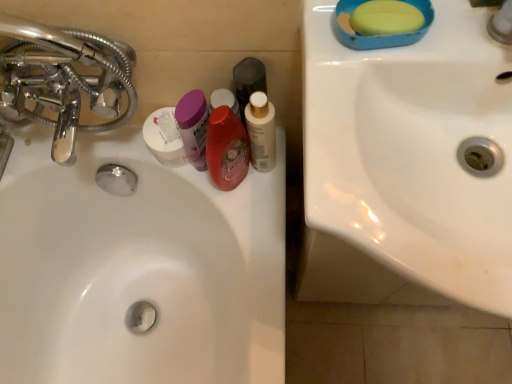
Describe the element at coordinates (193, 126) in the screenshot. I see `purple plastic container at center, the first mouthwash positioned from the left` at that location.

The width and height of the screenshot is (512, 384). What do you see at coordinates (125, 238) in the screenshot?
I see `white glossy sink at center, which is the 2th sink in right-to-left order` at bounding box center [125, 238].

This screenshot has width=512, height=384. What do you see at coordinates (406, 163) in the screenshot?
I see `white glossy sink at upper right, marked as the 2th sink in a back-to-front arrangement` at bounding box center [406, 163].

Where is `white glossy mouthwash at center, the 1th mouthwash viewed from the right`? This screenshot has height=384, width=512. white glossy mouthwash at center, the 1th mouthwash viewed from the right is located at coordinates (261, 131).

What do you see at coordinates (248, 81) in the screenshot? I see `black matte bottle at center, the 2th mouthwash in the right-to-left sequence` at bounding box center [248, 81].

Describe the element at coordinates (386, 18) in the screenshot. I see `yellow matte soap at upper right` at that location.

At what (x,y) coordinates should I click in order to perform the action: click on purple plastic container at center, the first mouthwash positioned from the left. Please return your answer as a coordinate pair (x, y). This screenshot has height=384, width=512. Looking at the image, I should click on (193, 126).

Would you say yellow matte soap at upper right is a long distance from white glossy mouthwash at center, the 4th mouthwash when ordered from left to right?

No, there isn't a large distance between yellow matte soap at upper right and white glossy mouthwash at center, the 4th mouthwash when ordered from left to right.

Is yellow matte soap at upper right situated inside white glossy mouthwash at center, the 4th mouthwash when ordered from left to right, or outside?

yellow matte soap at upper right is outside white glossy mouthwash at center, the 4th mouthwash when ordered from left to right.

Between yellow matte soap at upper right and white glossy mouthwash at center, the 4th mouthwash when ordered from left to right, which one has more height?

With more height is white glossy mouthwash at center, the 4th mouthwash when ordered from left to right.

Does yellow matte soap at upper right have a smaller size compared to white glossy mouthwash at center, the 1th mouthwash viewed from the right?

Yes.

What are the coordinates of `toiletry located below the chrome metallic faucet at left (from the image's perspective)` in the screenshot? It's located at (164, 138).

Which of these two, chrome metallic faucet at left or white matte container at center, is thinner?

Thinner between the two is white matte container at center.

From a real-world perspective, who is located lower, chrome metallic faucet at left or white matte container at center?

In real-world perspective, white matte container at center is lower.

From the image's perspective, is chrome metallic faucet at left located above or below white matte container at center?

chrome metallic faucet at left is situated higher than white matte container at center in the image.

Which is more to the right, black matte bottle at center, which is the 3th mouthwash in left-to-right order, or chrome metallic faucet at left?

black matte bottle at center, which is the 3th mouthwash in left-to-right order.

Between black matte bottle at center, the 2th mouthwash in the right-to-left sequence, and chrome metallic faucet at left, which one has smaller size?

With smaller size is black matte bottle at center, the 2th mouthwash in the right-to-left sequence.

Who is shorter, black matte bottle at center, which is the 3th mouthwash in left-to-right order, or chrome metallic faucet at left?

black matte bottle at center, which is the 3th mouthwash in left-to-right order.

Looking at this image, does black matte bottle at center, which is the 3th mouthwash in left-to-right order, turn towards chrome metallic faucet at left?

No, black matte bottle at center, which is the 3th mouthwash in left-to-right order, does not turn towards chrome metallic faucet at left.

Can we say purple plastic container at center, the fourth mouthwash when ordered from right to left, lies outside translucent purple mouthwash at center, the third mouthwash from the right?

purple plastic container at center, the fourth mouthwash when ordered from right to left, is positioned outside translucent purple mouthwash at center, the third mouthwash from the right.

From a real-world perspective, is purple plastic container at center, the fourth mouthwash when ordered from right to left, below translucent purple mouthwash at center, the third mouthwash from the right?

Indeed, from a real-world perspective, purple plastic container at center, the fourth mouthwash when ordered from right to left, is positioned beneath translucent purple mouthwash at center, the third mouthwash from the right.

Considering the sizes of purple plastic container at center, the first mouthwash positioned from the left, and translucent purple mouthwash at center, the third mouthwash from the right, in the image, is purple plastic container at center, the first mouthwash positioned from the left, wider or thinner than translucent purple mouthwash at center, the third mouthwash from the right,?

Clearly, purple plastic container at center, the first mouthwash positioned from the left, has less width compared to translucent purple mouthwash at center, the third mouthwash from the right.

Relative to translucent purple mouthwash at center, which is the second mouthwash in left-to-right order, is purple plastic container at center, the fourth mouthwash when ordered from right to left, in front or behind?

Visually, purple plastic container at center, the fourth mouthwash when ordered from right to left, is located behind translucent purple mouthwash at center, which is the second mouthwash in left-to-right order.

From the image's perspective, which one is positioned higher, yellow matte soap at upper right or chrome metallic faucet at left?

yellow matte soap at upper right appears higher in the image.

Looking at this image, is yellow matte soap at upper right thinner than chrome metallic faucet at left?

Indeed, yellow matte soap at upper right has a lesser width compared to chrome metallic faucet at left.

Which is less distant, (x=382, y=7) or (x=45, y=120)?

Point (x=382, y=7) is positioned closer to the camera compared to point (x=45, y=120).

Considering the sizes of objects yellow matte soap at upper right and chrome metallic faucet at left in the image provided, who is taller, yellow matte soap at upper right or chrome metallic faucet at left?

With more height is chrome metallic faucet at left.

Considering the relative sizes of black matte bottle at center, which is the 3th mouthwash in left-to-right order, and white glossy sink at center, which appears as the 1th sink when viewed from the back, in the image provided, is black matte bottle at center, which is the 3th mouthwash in left-to-right order, taller than white glossy sink at center, which appears as the 1th sink when viewed from the back,?

No.

From a real-world perspective, relative to white glossy sink at center, which appears as the 1th sink when viewed from the back, is black matte bottle at center, which is the 3th mouthwash in left-to-right order, vertically above or below?

Clearly, from a real-world perspective, black matte bottle at center, which is the 3th mouthwash in left-to-right order, is above white glossy sink at center, which appears as the 1th sink when viewed from the back.

Which object is thinner, black matte bottle at center, the 2th mouthwash in the right-to-left sequence, or white glossy sink at center, which appears as the 1th sink when viewed from the back?

black matte bottle at center, the 2th mouthwash in the right-to-left sequence, is thinner.

Between black matte bottle at center, the 2th mouthwash in the right-to-left sequence, and purple plastic container at center, the first mouthwash positioned from the left, which one has smaller size?

black matte bottle at center, the 2th mouthwash in the right-to-left sequence.

Is the surface of black matte bottle at center, the 2th mouthwash in the right-to-left sequence, in direct contact with purple plastic container at center, the first mouthwash positioned from the left?

Yes, black matte bottle at center, the 2th mouthwash in the right-to-left sequence, and purple plastic container at center, the first mouthwash positioned from the left, clearly make contact.

From a real-world perspective, is black matte bottle at center, which is the 3th mouthwash in left-to-right order, above or below purple plastic container at center, the first mouthwash positioned from the left?

In terms of real-world spatial position, black matte bottle at center, which is the 3th mouthwash in left-to-right order, is above purple plastic container at center, the first mouthwash positioned from the left.

In the scene shown: Is black matte bottle at center, which is the 3th mouthwash in left-to-right order, facing towards purple plastic container at center, the fourth mouthwash when ordered from right to left?

No, black matte bottle at center, which is the 3th mouthwash in left-to-right order, is not facing towards purple plastic container at center, the fourth mouthwash when ordered from right to left.

Locate an element on the screen. soap lying on the right of white glossy mouthwash at center, the 1th mouthwash viewed from the right is located at coordinates (386, 18).

You are a GUI agent. You are given a task and a screenshot of the screen. Output one action in this format:
    pyautogui.click(x=<x>, y=<y>)
    Task: Click on the toiletry behind the chrome metallic faucet at left
    This screenshot has height=384, width=512.
    Given the screenshot: What is the action you would take?
    pyautogui.click(x=164, y=138)

Based on their spatial positions, is white matte container at center or white glossy sink at center, arranged as the second sink when viewed from the front, further from white glossy sink at upper right, the first sink viewed from the right?

white matte container at center.

Estimate the real-world distances between objects in this image. Which object is further from white glossy sink at upper right, which is counted as the first sink, starting from the front, black matte bottle at center, the 2th mouthwash in the right-to-left sequence, or chrome metallic faucet at left?

chrome metallic faucet at left.

Estimate the real-world distances between objects in this image. Which object is closer to white glossy sink at upper right, the 2th sink in the left-to-right sequence, translucent purple mouthwash at center, which is the second mouthwash in left-to-right order, or chrome metallic faucet at left?

The object closer to white glossy sink at upper right, the 2th sink in the left-to-right sequence, is translucent purple mouthwash at center, which is the second mouthwash in left-to-right order.

When comparing their distances from black matte bottle at center, which is the 3th mouthwash in left-to-right order, does purple plastic container at center, the fourth mouthwash when ordered from right to left, or white glossy sink at upper right, the 2th sink in the left-to-right sequence, seem closer?

Among the two, purple plastic container at center, the fourth mouthwash when ordered from right to left, is located nearer to black matte bottle at center, which is the 3th mouthwash in left-to-right order.

From the image, which object appears to be farther from white matte container at center, chrome metallic faucet at left or translucent purple mouthwash at center, the third mouthwash from the right?

Based on the image, chrome metallic faucet at left appears to be further to white matte container at center.

Estimate the real-world distances between objects in this image. Which object is closer to yellow matte soap at upper right, translucent purple mouthwash at center, the third mouthwash from the right, or white glossy sink at upper right, which is counted as the first sink, starting from the front?

Among the two, white glossy sink at upper right, which is counted as the first sink, starting from the front, is located nearer to yellow matte soap at upper right.

Based on their spatial positions, is white glossy mouthwash at center, the 1th mouthwash viewed from the right, or white glossy sink at center, placed as the 1th sink when sorted from left to right, further from yellow matte soap at upper right?

Based on the image, white glossy sink at center, placed as the 1th sink when sorted from left to right, appears to be further to yellow matte soap at upper right.

Considering their positions, is yellow matte soap at upper right positioned closer to white glossy sink at upper right, the first sink viewed from the right, than translucent purple mouthwash at center, which is the second mouthwash in left-to-right order?

yellow matte soap at upper right is positioned closer to the anchor white glossy sink at upper right, the first sink viewed from the right.

Where is `soap between chrome metallic faucet at left and white glossy sink at upper right, marked as the 2th sink in a back-to-front arrangement, from left to right`? The width and height of the screenshot is (512, 384). soap between chrome metallic faucet at left and white glossy sink at upper right, marked as the 2th sink in a back-to-front arrangement, from left to right is located at coordinates (386, 18).

Locate an element on the screen. toiletry between white glossy sink at center, arranged as the second sink when viewed from the front, and white glossy sink at upper right, which is counted as the first sink, starting from the front, from left to right is located at coordinates 164,138.

This screenshot has width=512, height=384. What are the coordinates of `soap between translucent purple mouthwash at center, which is the second mouthwash in left-to-right order, and white glossy sink at upper right, the 2th sink in the left-to-right sequence, from left to right` in the screenshot? It's located at (386, 18).

The width and height of the screenshot is (512, 384). I want to click on soap located between white glossy sink at center, which is the 2th sink in right-to-left order, and white glossy sink at upper right, the first sink viewed from the right, in the left-right direction, so click(x=386, y=18).